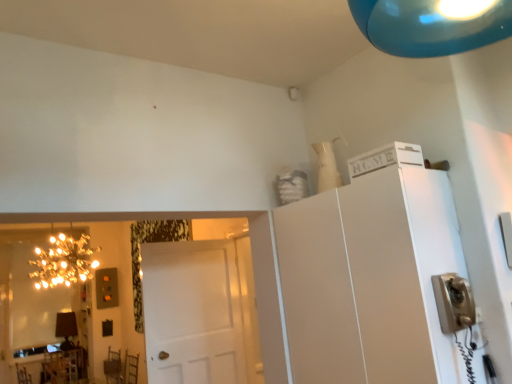
Question: Is white matte door at center wider or thinner than gold reflective mirror at left?

Choices:
 (A) wide
 (B) thin

Answer: (B)

Question: Considering the positions of white matte door at center and gold reflective mirror at left in the image, is white matte door at center bigger or smaller than gold reflective mirror at left?

Choices:
 (A) big
 (B) small

Answer: (B)

Question: Estimate the real-world distances between objects in this image. Which object is farther from the illuminated string lights at left?

Choices:
 (A) wooden table at lower left
 (B) white matte cabinet at upper right
 (C) gold reflective mirror at left
 (D) matte black lamp at lower left
 (E) white matte door at center

Answer: (B)

Question: Which of these objects is positioned closest to the white matte door at center?

Choices:
 (A) matte black lamp at lower left
 (B) illuminated string lights at left
 (C) white matte cabinet at upper right
 (D) wooden table at lower left
 (E) gold reflective mirror at left

Answer: (C)